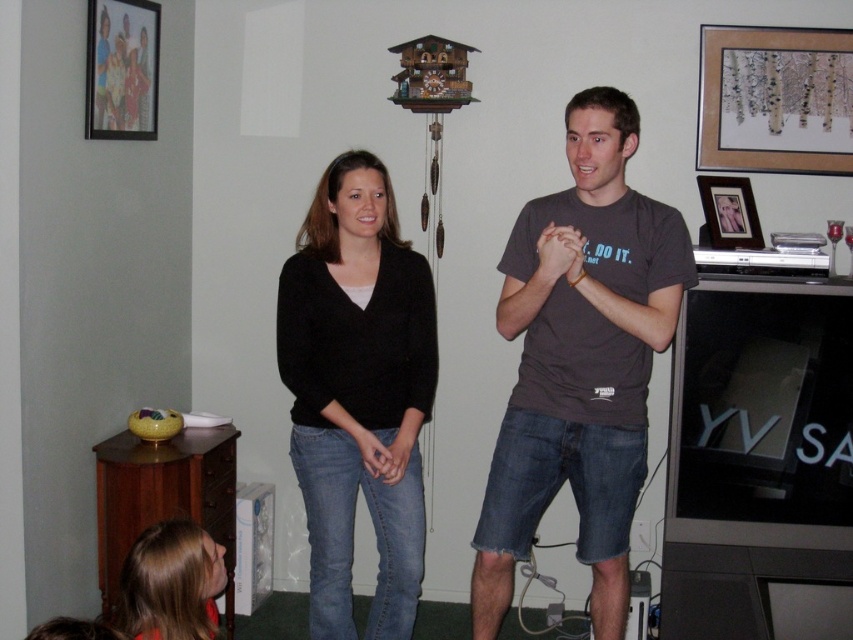
Question: Is wooden picture frame at upper left thinner than matte black picture frame at upper right?

Choices:
 (A) yes
 (B) no

Answer: (A)

Question: Which point appears farthest from the camera in this image?

Choices:
 (A) (526, 250)
 (B) (729, 216)
 (C) (173, 568)

Answer: (B)

Question: Is dark gray t-shirt at center below wooden picture frame at upper left?

Choices:
 (A) yes
 (B) no

Answer: (A)

Question: Can you confirm if blonde hair at lower left is positioned to the left of wooden picture frame at upper left?

Choices:
 (A) yes
 (B) no

Answer: (B)

Question: Among these objects, which one is nearest to the camera?

Choices:
 (A) matte black picture frame at upper right
 (B) matte brown picture frame at upper right
 (C) dark gray t-shirt at center
 (D) blonde hair at lower left

Answer: (D)

Question: Among these objects, which one is farthest from the camera?

Choices:
 (A) wooden picture frame at upper left
 (B) dark gray t-shirt at center

Answer: (A)